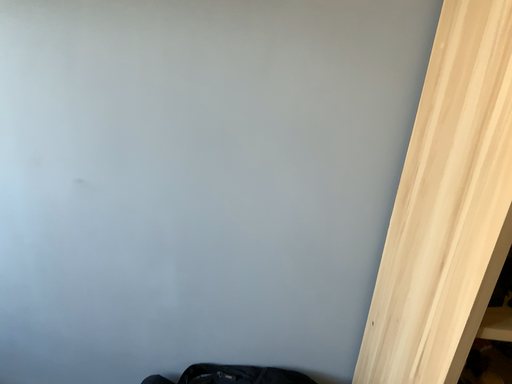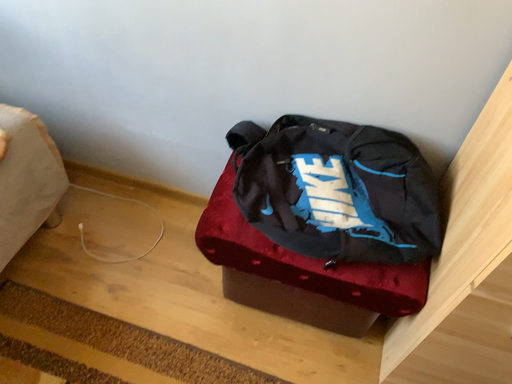
Question: Which way did the camera rotate in the video?

Choices:
 (A) rotated upward
 (B) rotated downward

Answer: (B)